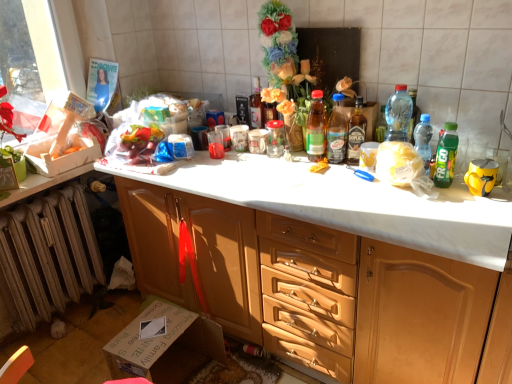
Question: From the image's perspective, is translucent plastic bottle at upper right, marked as the sixth bottle in a left-to-right arrangement, below translucent plastic bottle at center, the 6th bottle when ordered from right to left?

Choices:
 (A) yes
 (B) no

Answer: (A)

Question: Is translucent plastic bottle at upper right, marked as the sixth bottle in a left-to-right arrangement, to the right of translucent plastic bottle at center, the 6th bottle when ordered from right to left, from the viewer's perspective?

Choices:
 (A) yes
 (B) no

Answer: (A)

Question: Is translucent plastic bottle at upper right, which is counted as the second bottle, starting from the right, completely or partially outside of translucent plastic bottle at center, the 6th bottle when ordered from right to left?

Choices:
 (A) no
 (B) yes

Answer: (B)

Question: Are translucent plastic bottle at upper right, which is counted as the second bottle, starting from the right, and translucent plastic bottle at center, the 6th bottle when ordered from right to left, beside each other?

Choices:
 (A) no
 (B) yes

Answer: (A)

Question: Does translucent plastic bottle at upper right, marked as the sixth bottle in a left-to-right arrangement, have a lesser height compared to translucent plastic bottle at center, acting as the second bottle starting from the left?

Choices:
 (A) yes
 (B) no

Answer: (A)

Question: Is translucent plastic bottle at center, which is the 5th bottle from right to left, bigger or smaller than transparent plastic bottle at right, the 3th bottle in the right-to-left sequence?

Choices:
 (A) big
 (B) small

Answer: (B)

Question: Considering the relative positions of translucent plastic bottle at center, which is the 5th bottle from right to left, and transparent plastic bottle at right, which is counted as the fifth bottle, starting from the left, in the image provided, is translucent plastic bottle at center, which is the 5th bottle from right to left, to the left or to the right of transparent plastic bottle at right, which is counted as the fifth bottle, starting from the left,?

Choices:
 (A) right
 (B) left

Answer: (B)

Question: From a real-world perspective, is translucent plastic bottle at center, which is the 5th bottle from right to left, above or below transparent plastic bottle at right, which is counted as the fifth bottle, starting from the left?

Choices:
 (A) above
 (B) below

Answer: (B)

Question: Which is correct: translucent plastic bottle at center, which is the 5th bottle from right to left, is inside transparent plastic bottle at right, which is counted as the fifth bottle, starting from the left, or outside of it?

Choices:
 (A) outside
 (B) inside

Answer: (A)

Question: From a real-world perspective, is transparent plastic bottle at right, which is counted as the fifth bottle, starting from the left, above or below rusty metal radiator at lower left?

Choices:
 (A) below
 (B) above

Answer: (B)

Question: From the image's perspective, is transparent plastic bottle at right, which is counted as the fifth bottle, starting from the left, positioned above or below rusty metal radiator at lower left?

Choices:
 (A) below
 (B) above

Answer: (B)

Question: Is transparent plastic bottle at right, the 3th bottle in the right-to-left sequence, inside or outside of rusty metal radiator at lower left?

Choices:
 (A) inside
 (B) outside

Answer: (B)

Question: In terms of height, does transparent plastic bottle at right, the 3th bottle in the right-to-left sequence, look taller or shorter compared to rusty metal radiator at lower left?

Choices:
 (A) short
 (B) tall

Answer: (A)

Question: Choose the correct answer: Is green plastic bottle at right, which ranks as the 7th bottle in left-to-right order, inside transparent plastic bottle at right, which is counted as the fifth bottle, starting from the left, or outside it?

Choices:
 (A) inside
 (B) outside

Answer: (B)

Question: From a real-world perspective, relative to transparent plastic bottle at right, the 3th bottle in the right-to-left sequence, is green plastic bottle at right, which ranks as the 1th bottle in right-to-left order, vertically above or below?

Choices:
 (A) below
 (B) above

Answer: (A)